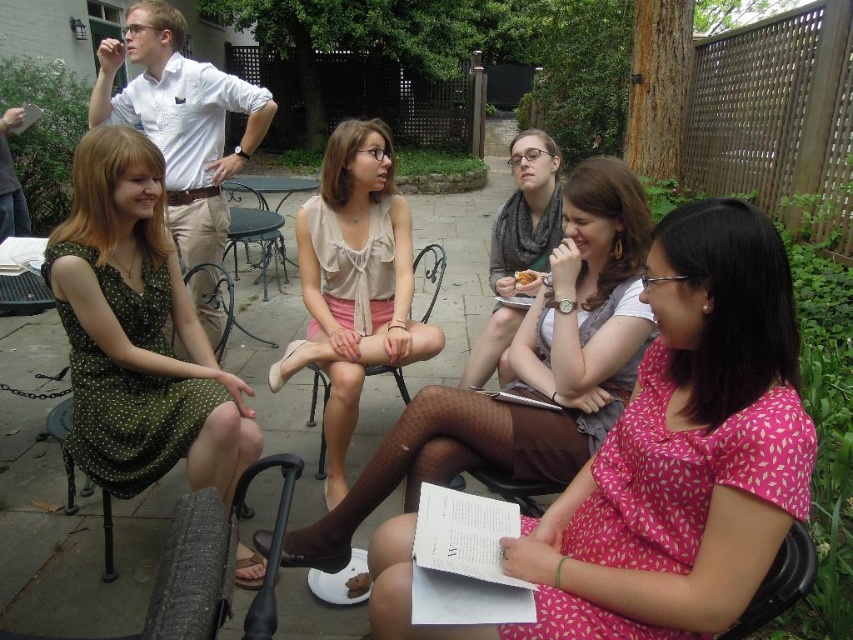
Consider the image. You are standing on the patio and want to walk from point A to point B. Point A is at coordinates point (231,225) and point B is at coordinates point (358,576). Which point is closer to you when you start walking?

Point A at coordinates point (231,225) is closer to you because it is further to the viewer than point B at coordinates point (358,576).

From the picture: You are standing on the patio and want to hand a document to both the green dotted dress at left and the beige chiffon blouse at center. Which person should you approach first to ensure you can reach them without moving from your current position?

You should approach the green dotted dress at left first because they are closer to you than the beige chiffon blouse at center, so you can reach them without moving.